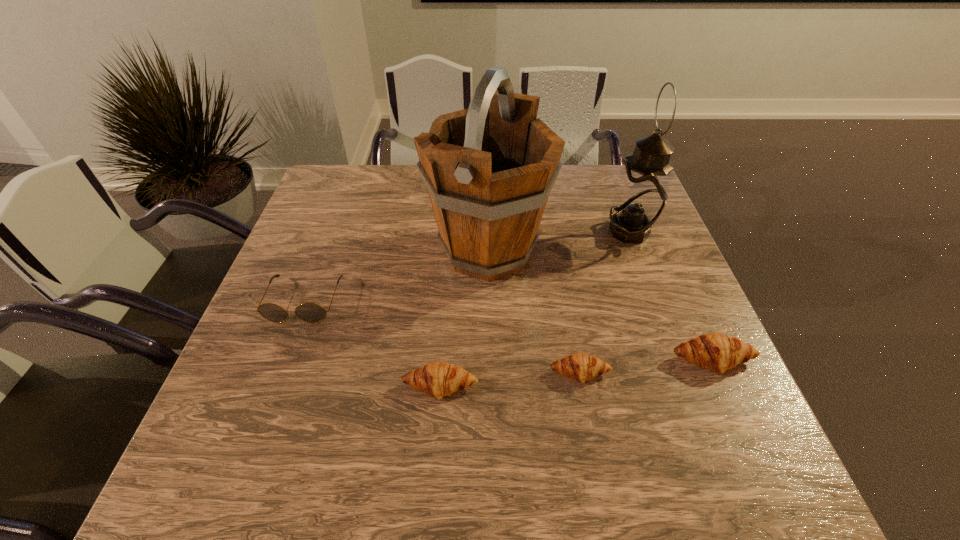
Locate an element on the screen. The image size is (960, 540). vacant region located 0.080m on the front of the oil lamp is located at coordinates (644, 269).

Identify the location of vacant area located on the left of the bucket. (290, 251).

At what (x,y) coordinates should I click in order to perform the action: click on free point located on the lenses of the sunglasses. Please return your answer as a coordinate pair (x, y). The width and height of the screenshot is (960, 540). Looking at the image, I should click on (267, 401).

Locate an element on the screen. This screenshot has width=960, height=540. object that is positioned at the near edge is located at coordinates (438, 379).

Locate an element on the screen. This screenshot has height=540, width=960. object at the left edge is located at coordinates (308, 312).

You are a GUI agent. You are given a task and a screenshot of the screen. Output one action in this format:
    pyautogui.click(x=<x>, y=<y>)
    Task: Click on the pastry at the right edge
    This screenshot has height=540, width=960.
    Given the screenshot: What is the action you would take?
    pyautogui.click(x=717, y=352)

The width and height of the screenshot is (960, 540). I want to click on oil lamp that is at the right edge, so click(x=640, y=196).

Find the location of `free space at the far edge`. free space at the far edge is located at coordinates (560, 205).

Locate an element on the screen. This screenshot has height=540, width=960. free point at the near edge is located at coordinates (618, 422).

Image resolution: width=960 pixels, height=540 pixels. I want to click on vacant region at the left edge of the desktop, so click(x=290, y=318).